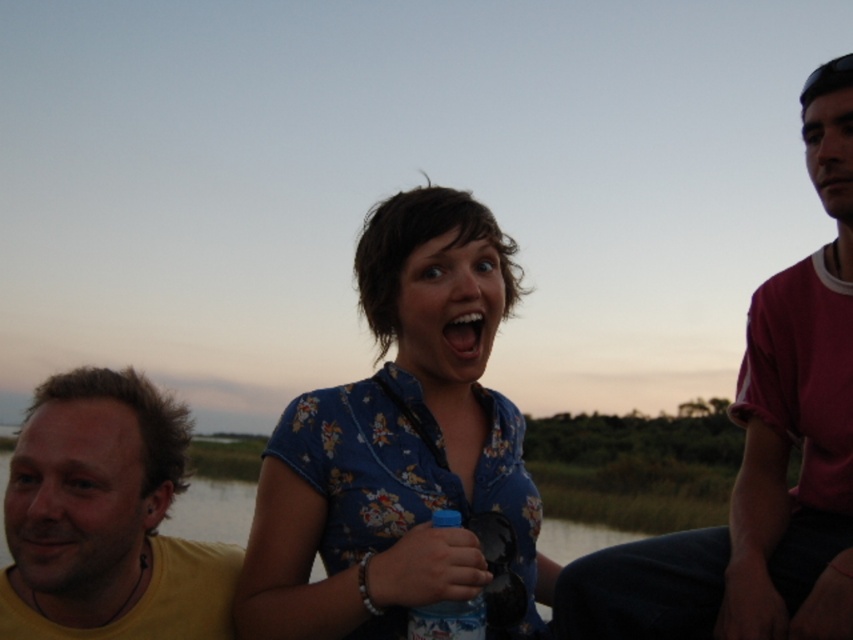
Between floral cotton shirt at center and blue plastic bottle at center, which one is positioned higher?

Positioned higher is floral cotton shirt at center.

Is floral cotton shirt at center to the left of blue plastic bottle at center from the viewer's perspective?

In fact, floral cotton shirt at center is to the right of blue plastic bottle at center.

Who is more forward, (386, 305) or (416, 628)?

Point (416, 628)

Locate an element on the screen. This screenshot has width=853, height=640. floral cotton shirt at center is located at coordinates (402, 448).

Which is more to the left, yellow matte shirt at left or blue plastic bottle at center?

Positioned to the left is yellow matte shirt at left.

Which is in front, point (62, 573) or point (447, 611)?

Point (447, 611) is in front.

Does point (96, 612) lie behind point (444, 627)?

Yes, it is behind point (444, 627).

Identify the location of yellow matte shirt at left. (106, 518).

Is matte pink shirt at right positioned at the back of blue plastic bottle at center?

Yes, it is behind blue plastic bottle at center.

Which is in front, point (693, 611) or point (436, 611)?

Point (436, 611)

I want to click on matte pink shirt at right, so click(761, 456).